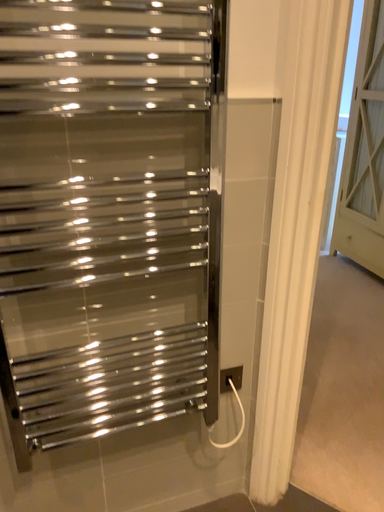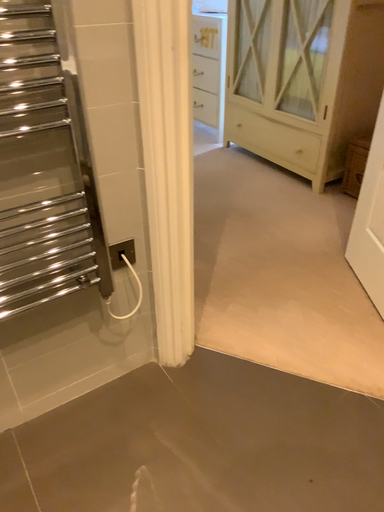
Question: Which way did the camera rotate in the video?

Choices:
 (A) rotated downward
 (B) rotated upward

Answer: (A)